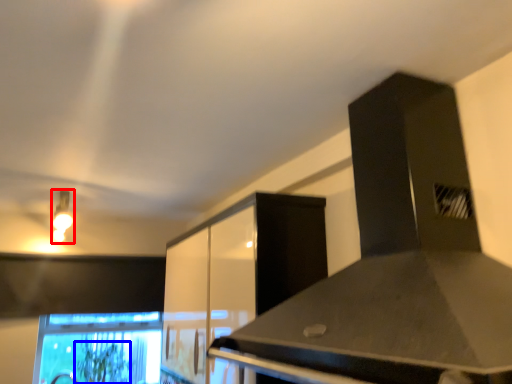
Question: Which object appears farthest to the camera in this image, light fixture (highlighted by a red box) or plant (highlighted by a blue box)?

Choices:
 (A) light fixture
 (B) plant

Answer: (B)